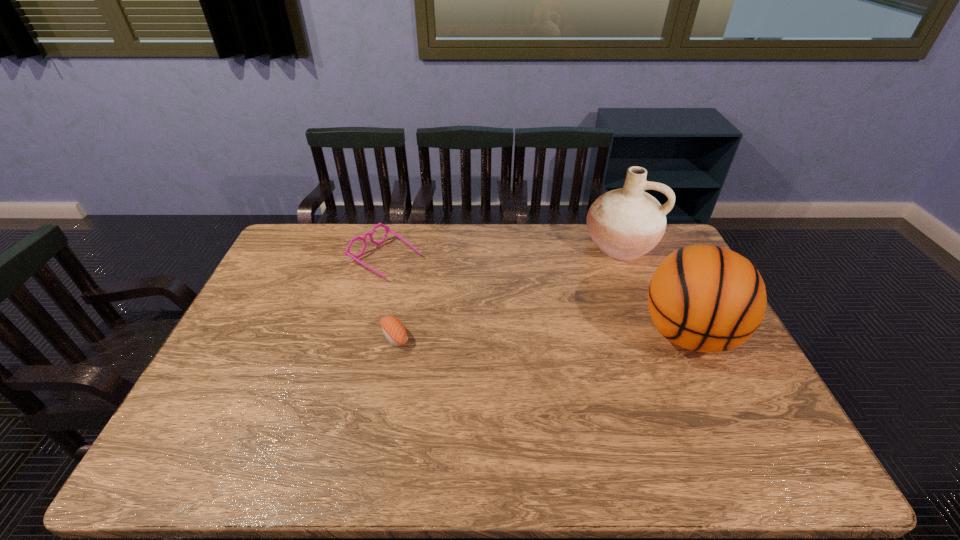
Find the location of a particular element. Image resolution: width=960 pixels, height=540 pixels. free space located 0.280m on the arms of the spectacles is located at coordinates (474, 311).

Identify the location of free region located on the arms of the spectacles. The width and height of the screenshot is (960, 540). (453, 298).

The image size is (960, 540). What are the coordinates of `pottery situated at the far edge` in the screenshot? It's located at (626, 223).

Identify the location of spectacles at the far edge. (347, 252).

Where is `basketball that is positioned at the right edge`? The height and width of the screenshot is (540, 960). basketball that is positioned at the right edge is located at coordinates (705, 298).

Where is `pottery present at the right edge`? This screenshot has width=960, height=540. pottery present at the right edge is located at coordinates (626, 223).

Where is `object that is at the far right corner`? The height and width of the screenshot is (540, 960). object that is at the far right corner is located at coordinates (626, 223).

This screenshot has height=540, width=960. What are the coordinates of `free space at the far edge of the desktop` in the screenshot? It's located at (593, 261).

Locate an element on the screen. The image size is (960, 540). vacant space at the near edge is located at coordinates (538, 417).

Where is `vacant space at the left edge`? The image size is (960, 540). vacant space at the left edge is located at coordinates [x=312, y=265].